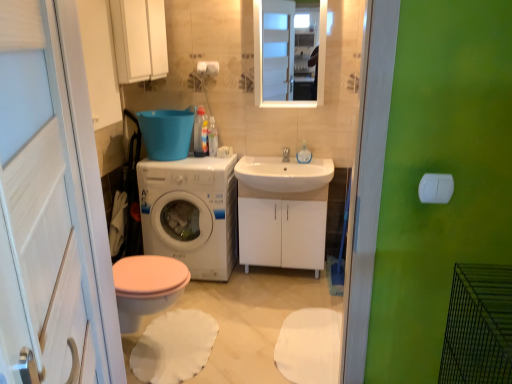
Question: Is white glossy cabinet at center thinner than white glossy cabinet at upper center?

Choices:
 (A) yes
 (B) no

Answer: (B)

Question: Is the depth of white glossy cabinet at center less than that of white glossy cabinet at upper center?

Choices:
 (A) yes
 (B) no

Answer: (B)

Question: Can you confirm if white glossy cabinet at center is shorter than white glossy cabinet at upper center?

Choices:
 (A) no
 (B) yes

Answer: (A)

Question: From a real-world perspective, is white glossy cabinet at center on top of white glossy cabinet at upper center?

Choices:
 (A) yes
 (B) no

Answer: (B)

Question: From a real-world perspective, is white glossy cabinet at center beneath white glossy cabinet at upper center?

Choices:
 (A) yes
 (B) no

Answer: (A)

Question: Could you tell me if white glossy cabinet at center is facing white glossy cabinet at upper center?

Choices:
 (A) yes
 (B) no

Answer: (B)

Question: Does white glossy cabinet at upper center have a lesser width compared to white glossy sink at center?

Choices:
 (A) no
 (B) yes

Answer: (B)

Question: Is white glossy cabinet at upper center oriented away from white glossy sink at center?

Choices:
 (A) no
 (B) yes

Answer: (A)

Question: Is white glossy cabinet at upper center outside of white glossy sink at center?

Choices:
 (A) yes
 (B) no

Answer: (A)

Question: Is white glossy cabinet at upper center facing towards white glossy sink at center?

Choices:
 (A) no
 (B) yes

Answer: (A)

Question: Would you consider white glossy cabinet at upper center to be distant from white glossy sink at center?

Choices:
 (A) yes
 (B) no

Answer: (B)

Question: Considering the relative sizes of white glossy cabinet at upper center and white glossy sink at center in the image provided, is white glossy cabinet at upper center wider than white glossy sink at center?

Choices:
 (A) yes
 (B) no

Answer: (B)

Question: Can you confirm if white glossy cabinet at center is smaller than white matte toilet paper at center?

Choices:
 (A) no
 (B) yes

Answer: (A)